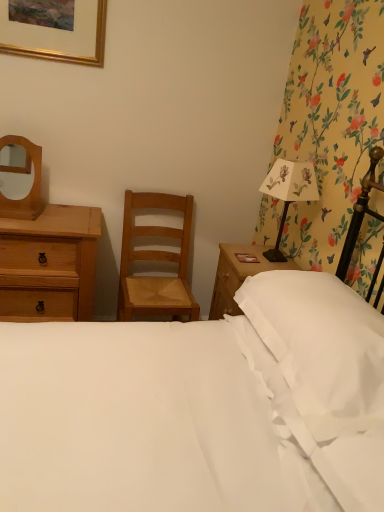
Question: From the image's perspective, would you say matte wooden mirror at upper left is shown under gold metallic picture frame at upper left?

Choices:
 (A) no
 (B) yes

Answer: (B)

Question: Is matte wooden mirror at upper left behind gold metallic picture frame at upper left?

Choices:
 (A) no
 (B) yes

Answer: (A)

Question: Is matte wooden mirror at upper left bigger than gold metallic picture frame at upper left?

Choices:
 (A) yes
 (B) no

Answer: (A)

Question: From the image's perspective, is matte wooden mirror at upper left located above gold metallic picture frame at upper left?

Choices:
 (A) yes
 (B) no

Answer: (B)

Question: Can you confirm if matte wooden mirror at upper left is positioned to the right of gold metallic picture frame at upper left?

Choices:
 (A) no
 (B) yes

Answer: (A)

Question: Are matte wooden mirror at upper left and gold metallic picture frame at upper left far apart?

Choices:
 (A) yes
 (B) no

Answer: (B)

Question: Is the position of white smooth bed at center more distant than that of gold metallic picture frame at upper left?

Choices:
 (A) no
 (B) yes

Answer: (A)

Question: Can you confirm if white smooth bed at center is taller than gold metallic picture frame at upper left?

Choices:
 (A) yes
 (B) no

Answer: (A)

Question: Can you confirm if white smooth bed at center is bigger than gold metallic picture frame at upper left?

Choices:
 (A) no
 (B) yes

Answer: (B)

Question: Is white smooth bed at center located outside gold metallic picture frame at upper left?

Choices:
 (A) yes
 (B) no

Answer: (A)

Question: Is white smooth bed at center wider than gold metallic picture frame at upper left?

Choices:
 (A) yes
 (B) no

Answer: (A)

Question: Is white smooth bed at center positioned with its back to gold metallic picture frame at upper left?

Choices:
 (A) yes
 (B) no

Answer: (B)

Question: Are white smooth bed at center and white soft pillow at right far apart?

Choices:
 (A) yes
 (B) no

Answer: (B)